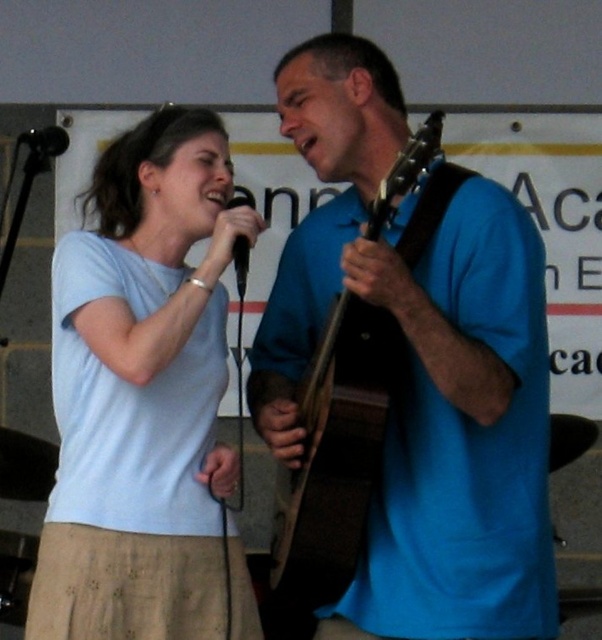
You are a stagehand who needs to adjust the distance between the light blue cotton shirt at center and the black matte microphone at upper left to 40 inches. Currently, how much farther do you need to move the microphone away from the shirt?

The light blue cotton shirt at center is currently 37.17 inches away from the black matte microphone at upper left. To reach the desired 40 inches, you need to move the microphone 2.83 inches farther away from the shirt.

You are a stagehand who needs to place a microphone stand exactly 0.1 units to the right of the blue matte guitar at center. What coordinate should you set the microphone stand to?

The blue matte guitar at center is at point (x=418, y=369). Adding 0.1 to the x coordinate gives 0.677. So the microphone stand should be placed at coordinate (x=418, y=433).

You are a stagehand preparing to adjust the lighting for the performance. You need to ensure that the blue matte guitar at center is properly lit. Since the light blue cotton shirt at center is also in the same area, will the guitar block the light reaching the shirt?

The blue matte guitar at center is in front of the light blue cotton shirt at center, so it may block some light from reaching the shirt. Adjust the lighting angles or add additional lights behind the guitar to ensure the shirt is well lit.